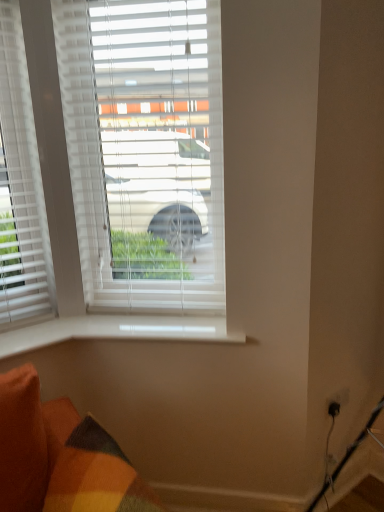
This screenshot has height=512, width=384. Describe the element at coordinates (117, 330) in the screenshot. I see `white smooth window sill at lower center` at that location.

The width and height of the screenshot is (384, 512). In order to click on white smooth window sill at lower center in this screenshot , I will do `click(117, 330)`.

Measure the distance between point (63, 333) and camera.

The distance of point (63, 333) from camera is 1.61 meters.

Locate an element on the screen. white plastic blinds at center is located at coordinates (144, 151).

Describe the element at coordinates (144, 151) in the screenshot. The height and width of the screenshot is (512, 384). I see `white plastic blinds at center` at that location.

This screenshot has height=512, width=384. Identify the location of white smooth window sill at lower center. (117, 330).

Based on their positions, is white plastic blinds at center located to the left or right of white smooth window sill at lower center?

white plastic blinds at center is positioned on white smooth window sill at lower center's left side.

Between white plastic blinds at center and white smooth window sill at lower center, which one is positioned in front?

white plastic blinds at center.

Does point (183, 272) appear closer or farther from the camera than point (3, 349)?

Point (183, 272) is positioned farther from the camera compared to point (3, 349).

From the image's perspective, does white plastic blinds at center appear lower than white smooth window sill at lower center?

Actually, white plastic blinds at center appears above white smooth window sill at lower center in the image.

From a real-world perspective, which is physically below, white plastic blinds at center or white smooth window sill at lower center?

white smooth window sill at lower center, from a real-world perspective.

From the picture: Which of these two, white plastic blinds at center or white smooth window sill at lower center, is wider?

Wider between the two is white smooth window sill at lower center.

Who is taller, white plastic blinds at center or white smooth window sill at lower center?

white plastic blinds at center.

Which of these two, white plastic blinds at center or white smooth window sill at lower center, is smaller?

Smaller between the two is white smooth window sill at lower center.

Is white plastic blinds at center not within white smooth window sill at lower center?

Yes.

Is white plastic blinds at center placed right next to white smooth window sill at lower center?

No, white plastic blinds at center is not touching white smooth window sill at lower center.

In the scene shown: Is white smooth window sill at lower center at the back of white plastic blinds at center?

No, white smooth window sill at lower center is not at the back of white plastic blinds at center.

How many degrees apart are the facing directions of white plastic blinds at center and white smooth window sill at lower center?

The facing directions of white plastic blinds at center and white smooth window sill at lower center are 2.33 degrees apart.

Find the location of a particular element. The height and width of the screenshot is (512, 384). window sill located behind the white plastic blinds at center is located at coordinates (117, 330).

Consider the image. Which object is positioned more to the left, white smooth window sill at lower center or white plastic blinds at center?

white plastic blinds at center.

Which object is closer to the camera, white smooth window sill at lower center or white plastic blinds at center?

white plastic blinds at center is more forward.

Considering the points (79, 320) and (122, 85), which point is in front, point (79, 320) or point (122, 85)?

The point (122, 85) is closer to the camera.

From the image's perspective, does white smooth window sill at lower center appear higher than white plastic blinds at center?

No.

From a real-world perspective, is white smooth window sill at lower center physically located above or below white plastic blinds at center?

From a real-world perspective, white smooth window sill at lower center is physically below white plastic blinds at center.

Considering the relative sizes of white smooth window sill at lower center and white plastic blinds at center in the image provided, is white smooth window sill at lower center wider than white plastic blinds at center?

Correct, the width of white smooth window sill at lower center exceeds that of white plastic blinds at center.

Based on the photo, is white smooth window sill at lower center taller than white plastic blinds at center?

In fact, white smooth window sill at lower center may be shorter than white plastic blinds at center.

Is white smooth window sill at lower center smaller than white plastic blinds at center?

Correct, white smooth window sill at lower center occupies less space than white plastic blinds at center.

Is white smooth window sill at lower center situated inside white plastic blinds at center or outside?

white smooth window sill at lower center lies outside white plastic blinds at center.

Is white smooth window sill at lower center in contact with white plastic blinds at center?

white smooth window sill at lower center and white plastic blinds at center are not in contact.

Is white smooth window sill at lower center facing away from white plastic blinds at center?

white smooth window sill at lower center does not have its back to white plastic blinds at center.

Locate an element on the screen. This screenshot has width=384, height=512. window sill below the white plastic blinds at center (from a real-world perspective) is located at coordinates (117, 330).

Where is `window above the white smooth window sill at lower center (from the image's perspective)`? This screenshot has width=384, height=512. window above the white smooth window sill at lower center (from the image's perspective) is located at coordinates (144, 151).

Find the location of a particular element. Image resolution: width=384 pixels, height=512 pixels. window sill beneath the white plastic blinds at center (from a real-world perspective) is located at coordinates (117, 330).